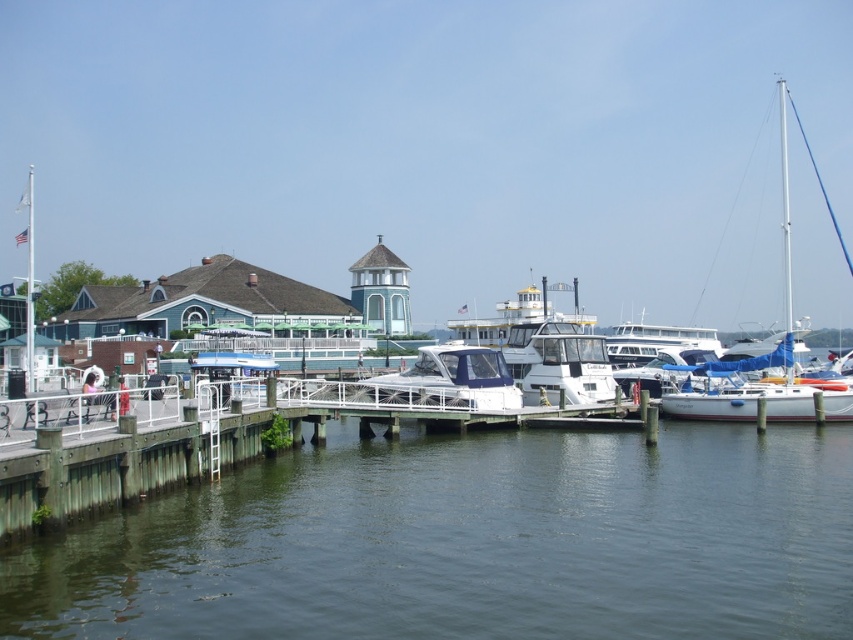
You are standing at the center of the image and want to walk to the wooden dock at lower left. Which direction should you move to reach it?

Since the wooden dock at lower left is located at point (132, 464) in 2D coordinates, you should move towards the lower left direction to reach it.